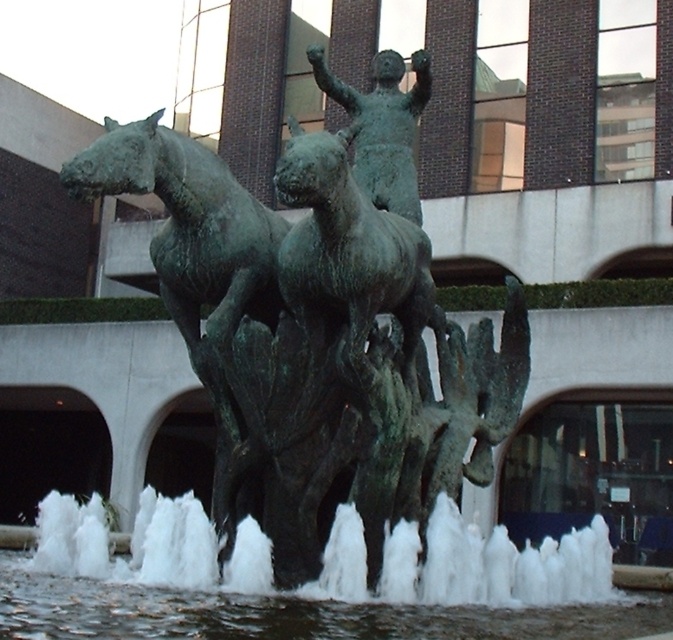
Does green patina bronze statue at center have a smaller size compared to green patina horse at left?

No.

Does point (466, 420) lie in front of point (219, 358)?

No, it is behind (219, 358).

Image resolution: width=673 pixels, height=640 pixels. What are the coordinates of `green patina bronze statue at center` in the screenshot? It's located at (326, 328).

Is green patina bronze statue at center taller than white frothy water at center?

Yes, green patina bronze statue at center is taller than white frothy water at center.

Does green patina bronze statue at center have a lesser height compared to white frothy water at center?

Incorrect, green patina bronze statue at center's height does not fall short of white frothy water at center's.

Is point (225, 368) closer to camera compared to point (92, 589)?

That is False.

At what (x,y) coordinates should I click in order to perform the action: click on green patina bronze statue at center. Please return your answer as a coordinate pair (x, y). This screenshot has height=640, width=673. Looking at the image, I should click on pos(326,328).

Between green patina horse at left and white frothy water at center, which one has less height?

white frothy water at center

Is green patina horse at left bigger than white frothy water at center?

No.

Between point (190, 280) and point (102, 628), which one is positioned in front?

Positioned in front is point (102, 628).

You are a GUI agent. You are given a task and a screenshot of the screen. Output one action in this format:
    pyautogui.click(x=<x>, y=<y>)
    Task: Click on the green patina horse at left
    This screenshot has width=673, height=640.
    Given the screenshot: What is the action you would take?
    pyautogui.click(x=197, y=262)